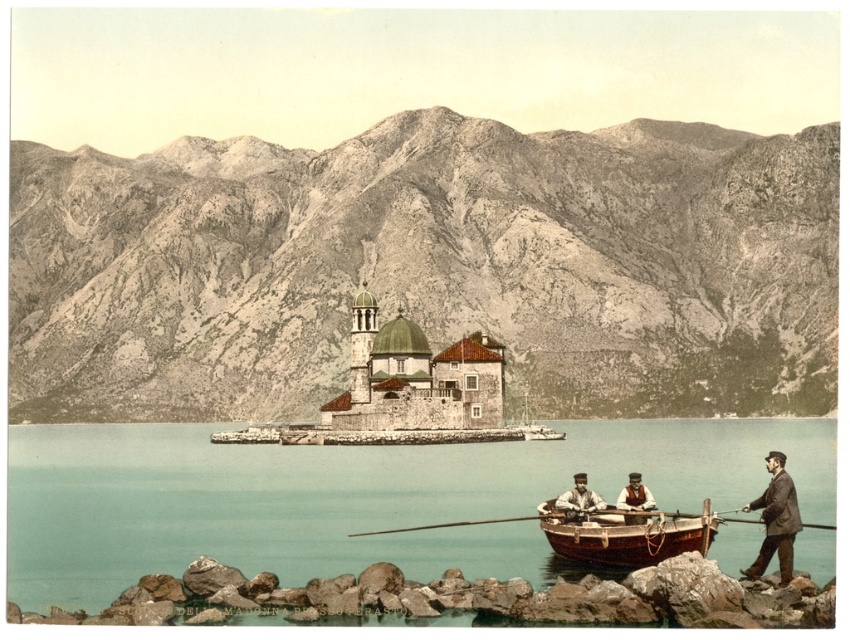
Is point (357, 237) farther from viewer compared to point (268, 490)?

That is True.

Who is lower down, rugged stone mountain at upper center or teal water at lower center?

teal water at lower center

Who is more distant from viewer, [485,157] or [55,548]?

Positioned behind is point [485,157].

Identify the location of rugged stone mountain at upper center. The image size is (850, 640). (428, 268).

Does brown leather jacket at lower right appear under brown leather jacket at center?

Incorrect, brown leather jacket at lower right is not positioned below brown leather jacket at center.

Which of these two, brown leather jacket at lower right or brown leather jacket at center, stands taller?

brown leather jacket at lower right

Who is more forward, (786, 500) or (574, 481)?

Point (786, 500)

The image size is (850, 640). Identify the location of brown leather jacket at lower right. (775, 518).

Which is above, wooden canoe at lower center or brown leather jacket at center?

wooden canoe at lower center

Is point (688, 534) positioned behind point (581, 516)?

That is False.

Is point (670, 548) in front of point (568, 509)?

Yes, point (670, 548) is in front of point (568, 509).

This screenshot has height=640, width=850. Find the location of `wooden canoe at lower center`. wooden canoe at lower center is located at coordinates (625, 534).